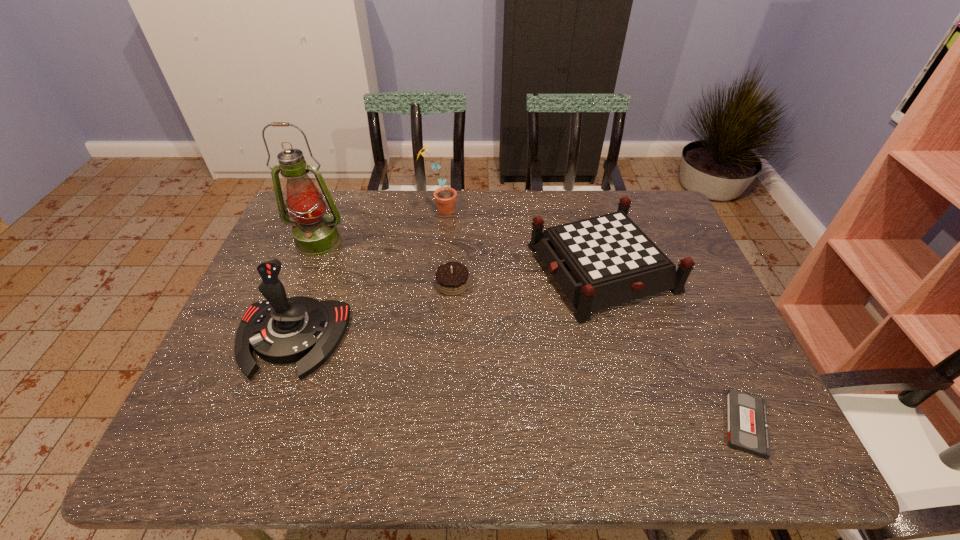
The width and height of the screenshot is (960, 540). I want to click on videotape present at the right edge, so click(x=747, y=424).

What are the coordinates of `object situated at the far left corner` in the screenshot? It's located at [315, 234].

Identify the location of object present at the far right corner. 600,262.

Where is `object located at the near right corner`? Image resolution: width=960 pixels, height=540 pixels. object located at the near right corner is located at coordinates (747, 424).

I want to click on vacant space at the far edge of the desktop, so click(x=547, y=215).

In the image, there is a desktop. Find the location of `vacant space at the near edge`. vacant space at the near edge is located at coordinates (347, 438).

The width and height of the screenshot is (960, 540). Find the location of `free space at the left edge of the desktop`. free space at the left edge of the desktop is located at coordinates (219, 354).

Find the location of `vacant space at the right edge of the desktop`. vacant space at the right edge of the desktop is located at coordinates (680, 363).

You are a GUI agent. You are given a task and a screenshot of the screen. Output one action in this format:
    pyautogui.click(x=<x>, y=<y>)
    Task: Click on the vacant area at the far left corner of the desktop
    Image resolution: width=960 pixels, height=540 pixels.
    Given the screenshot: What is the action you would take?
    pyautogui.click(x=347, y=190)

In the image, there is a desktop. Identify the location of free space at the near left corner. The image size is (960, 540). (210, 446).